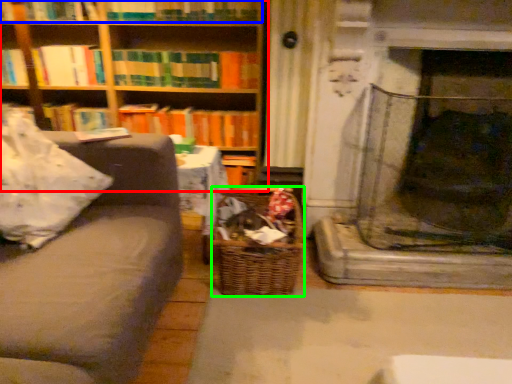
Question: Considering the real-world distances, which object is farthest from bookcase (highlighted by a red box)? book (highlighted by a blue box) or basket (highlighted by a green box)?

Choices:
 (A) book
 (B) basket

Answer: (B)